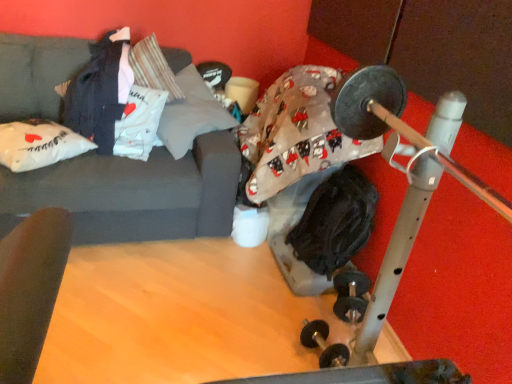
This screenshot has height=384, width=512. What do you see at coordinates (351, 295) in the screenshot?
I see `black rubber dumbbells at lower center` at bounding box center [351, 295].

Locate an element on the screen. dark gray fabric couch at upper left is located at coordinates (132, 193).

The height and width of the screenshot is (384, 512). What are the coordinates of `gray fabric pillow at upper center, the first pillow positioned from the right` in the screenshot? It's located at (191, 114).

The image size is (512, 384). I want to click on black rubber dumbbells at lower center, so (x=351, y=295).

Based on their sizes in the image, would you say dark gray fabric at upper left, the first clothing positioned from the top, is bigger or smaller than black fabric at center, which is the second clothing from left to right?

dark gray fabric at upper left, the first clothing positioned from the top, is bigger than black fabric at center, which is the second clothing from left to right.

From a real-world perspective, is dark gray fabric at upper left, the 2th clothing viewed from the right, under black fabric at center, the 2th clothing in the top-to-bottom sequence?

No, from a real-world perspective, dark gray fabric at upper left, the 2th clothing viewed from the right, is not under black fabric at center, the 2th clothing in the top-to-bottom sequence.

Does point (102, 125) come in front of point (320, 234)?

Yes, it is in front of point (320, 234).

Considering the positions of objects dark gray fabric at upper left, arranged as the 1th clothing when viewed from the left, and black fabric at center, acting as the first clothing starting from the bottom, in the image provided, who is more to the left, dark gray fabric at upper left, arranged as the 1th clothing when viewed from the left, or black fabric at center, acting as the first clothing starting from the bottom,?

Positioned to the left is dark gray fabric at upper left, arranged as the 1th clothing when viewed from the left.

Is black fabric at center, which is the second clothing from left to right, far away from dark gray fabric at upper left, which ranks as the 2th clothing in bottom-to-top order?

Yes.

Does black fabric at center, which is the second clothing from left to right, turn towards dark gray fabric at upper left, arranged as the 1th clothing when viewed from the left?

No, black fabric at center, which is the second clothing from left to right, does not turn towards dark gray fabric at upper left, arranged as the 1th clothing when viewed from the left.

You are a GUI agent. You are given a task and a screenshot of the screen. Output one action in this format:
    pyautogui.click(x=<x>, y=<y>)
    Task: Click on the clothing below the dark gray fabric at upper left, arranged as the 1th clothing when viewed from the left (from the image's perspective)
    This screenshot has width=512, height=384.
    Given the screenshot: What is the action you would take?
    pyautogui.click(x=335, y=221)

Between black fabric at center, acting as the first clothing starting from the bottom, and dark gray fabric at upper left, which ranks as the 2th clothing in bottom-to-top order, which one is positioned in front?

black fabric at center, acting as the first clothing starting from the bottom, is in front.

Based on their positions, is dark gray fabric couch at upper left located to the left or right of white fabric pillow at left, arranged as the 2th pillow when viewed from the right?

dark gray fabric couch at upper left is positioned on white fabric pillow at left, arranged as the 2th pillow when viewed from the right,'s right side.

From a real-world perspective, count 1st pillows upward from the dark gray fabric couch at upper left and point to it. Please provide its 2D coordinates.

[(39, 144)]

Which object is closer to the camera taking this photo, dark gray fabric couch at upper left or white fabric pillow at left, arranged as the 2th pillow when viewed from the right?

dark gray fabric couch at upper left is closer to the camera.

Is dark gray fabric couch at upper left spatially inside white fabric pillow at left, marked as the first pillow in a left-to-right arrangement, or outside of it?

dark gray fabric couch at upper left is outside white fabric pillow at left, marked as the first pillow in a left-to-right arrangement.

Between white fabric pillow at left, arranged as the 2th pillow when viewed from the right, and dark gray fabric couch at upper left, which one is positioned in front?

Positioned in front is dark gray fabric couch at upper left.

Is white fabric pillow at left, arranged as the 2th pillow when viewed from the right, situated inside dark gray fabric couch at upper left or outside?

white fabric pillow at left, arranged as the 2th pillow when viewed from the right, can be found inside dark gray fabric couch at upper left.

Is there a large distance between white fabric pillow at left, arranged as the 2th pillow when viewed from the right, and dark gray fabric couch at upper left?

Actually, white fabric pillow at left, arranged as the 2th pillow when viewed from the right, and dark gray fabric couch at upper left are a little close together.

Considering the sizes of objects white fabric pillow at left, arranged as the 2th pillow when viewed from the right, and dark gray fabric couch at upper left in the image provided, who is thinner, white fabric pillow at left, arranged as the 2th pillow when viewed from the right, or dark gray fabric couch at upper left?

white fabric pillow at left, arranged as the 2th pillow when viewed from the right.

Consider the image. How many degrees apart are the facing directions of white fabric pillow at left, arranged as the 2th pillow when viewed from the right, and black rubber dumbbells at lower center?

The angle between the facing direction of white fabric pillow at left, arranged as the 2th pillow when viewed from the right, and the facing direction of black rubber dumbbells at lower center is 159 degrees.

Is point (29, 149) positioned behind point (351, 274)?

No, (29, 149) is closer to viewer.

Is white fabric pillow at left, marked as the first pillow in a left-to-right arrangement, taller or shorter than black rubber dumbbells at lower center?

white fabric pillow at left, marked as the first pillow in a left-to-right arrangement, is shorter than black rubber dumbbells at lower center.

Does white fabric pillow at left, arranged as the 2th pillow when viewed from the right, turn towards black rubber dumbbells at lower center?

No, white fabric pillow at left, arranged as the 2th pillow when viewed from the right, does not turn towards black rubber dumbbells at lower center.

Locate an element on the screen. studio couch that is in front of the gray fabric pillow at upper center, positioned as the second pillow in left-to-right order is located at coordinates (132, 193).

Is the surface of dark gray fabric couch at upper left in direct contact with gray fabric pillow at upper center, the first pillow positioned from the right?

dark gray fabric couch at upper left is not next to gray fabric pillow at upper center, the first pillow positioned from the right, and they're not touching.

Who is shorter, dark gray fabric couch at upper left or gray fabric pillow at upper center, positioned as the second pillow in left-to-right order?

Standing shorter between the two is gray fabric pillow at upper center, positioned as the second pillow in left-to-right order.

Considering the points (159, 184) and (180, 88), which point is behind, point (159, 184) or point (180, 88)?

The point (180, 88) is farther from the camera.

From a real-world perspective, which pillow is the 1st one above the black fabric at center, the 2th clothing in the top-to-bottom sequence? Please provide its 2D coordinates.

[(39, 144)]

From the image's perspective, is black fabric at center, which is the second clothing from left to right, above or below white fabric pillow at left, marked as the first pillow in a left-to-right arrangement?

Answer: Based on their image positions, black fabric at center, which is the second clothing from left to right, is located beneath white fabric pillow at left, marked as the first pillow in a left-to-right arrangement.

Considering the positions of objects black fabric at center, the 2th clothing in the top-to-bottom sequence, and white fabric pillow at left, arranged as the 2th pillow when viewed from the right, in the image provided, who is more to the right, black fabric at center, the 2th clothing in the top-to-bottom sequence, or white fabric pillow at left, arranged as the 2th pillow when viewed from the right,?

black fabric at center, the 2th clothing in the top-to-bottom sequence.

Would you say black fabric at center, which is the second clothing from left to right, is inside or outside white fabric pillow at left, arranged as the 2th pillow when viewed from the right?

black fabric at center, which is the second clothing from left to right, is not enclosed by white fabric pillow at left, arranged as the 2th pillow when viewed from the right.

This screenshot has height=384, width=512. What are the coordinates of `clothing on the right side of dark gray fabric at upper left, arranged as the 1th clothing when viewed from the left` in the screenshot? It's located at (335, 221).

Locate an element on the screen. This screenshot has height=384, width=512. clothing above the black fabric at center, acting as the first clothing starting from the bottom (from the image's perspective) is located at coordinates (100, 90).

Which object lies nearer to the anchor point dark gray fabric at upper left, the 2th clothing viewed from the right, gray fabric pillow at upper center, the first pillow positioned from the right, or white fabric pillow at left, marked as the first pillow in a left-to-right arrangement?

white fabric pillow at left, marked as the first pillow in a left-to-right arrangement.

When comparing their distances from black rubber dumbbells at lower center, does black fabric at center, which is the second clothing from left to right, or white fabric pillow at left, arranged as the 2th pillow when viewed from the right, seem closer?

Based on the image, black fabric at center, which is the second clothing from left to right, appears to be nearer to black rubber dumbbells at lower center.

When comparing their distances from white fabric pillow at left, arranged as the 2th pillow when viewed from the right, does gray fabric pillow at upper center, positioned as the second pillow in left-to-right order, or black rubber dumbbells at lower center seem closer?

Among the two, gray fabric pillow at upper center, positioned as the second pillow in left-to-right order, is located nearer to white fabric pillow at left, arranged as the 2th pillow when viewed from the right.

From the picture: Based on their spatial positions, is white fabric pillow at left, marked as the first pillow in a left-to-right arrangement, or dark gray fabric at upper left, which ranks as the 2th clothing in bottom-to-top order, closer to black rubber dumbbells at lower center?

dark gray fabric at upper left, which ranks as the 2th clothing in bottom-to-top order, is positioned closer to the anchor black rubber dumbbells at lower center.

Looking at the image, which one is located closer to gray fabric pillow at upper center, positioned as the second pillow in left-to-right order, dark gray fabric at upper left, which ranks as the 2th clothing in bottom-to-top order, or black fabric at center, which is the second clothing from left to right?

Based on the image, dark gray fabric at upper left, which ranks as the 2th clothing in bottom-to-top order, appears to be nearer to gray fabric pillow at upper center, positioned as the second pillow in left-to-right order.

Based on their spatial positions, is dark gray fabric couch at upper left or white fabric pillow at left, arranged as the 2th pillow when viewed from the right, closer to black fabric at center, which is counted as the first clothing, starting from the right?

dark gray fabric couch at upper left is closer to black fabric at center, which is counted as the first clothing, starting from the right.

Which object lies further to the anchor point dark gray fabric at upper left, the 2th clothing viewed from the right, black fabric at center, which is the second clothing from left to right, or white fabric pillow at left, marked as the first pillow in a left-to-right arrangement?

black fabric at center, which is the second clothing from left to right, is further to dark gray fabric at upper left, the 2th clothing viewed from the right.

Estimate the real-world distances between objects in this image. Which object is closer to gray fabric pillow at upper center, the first pillow positioned from the right, dark gray fabric at upper left, the 2th clothing viewed from the right, or dark gray fabric couch at upper left?

dark gray fabric couch at upper left.

This screenshot has width=512, height=384. What are the coordinates of `clothing between gray fabric pillow at upper center, the first pillow positioned from the right, and black rubber dumbbells at lower center in the up-down direction` in the screenshot? It's located at (335, 221).

This screenshot has height=384, width=512. In order to click on pillow located between white fabric pillow at left, arranged as the 2th pillow when viewed from the right, and black fabric at center, acting as the first clothing starting from the bottom, in the left-right direction in this screenshot , I will do `click(191, 114)`.

Where is `clothing between dark gray fabric at upper left, the 2th clothing viewed from the right, and black rubber dumbbells at lower center from left to right`? Image resolution: width=512 pixels, height=384 pixels. clothing between dark gray fabric at upper left, the 2th clothing viewed from the right, and black rubber dumbbells at lower center from left to right is located at coordinates (335, 221).

Where is `studio couch between white fabric pillow at left, marked as the first pillow in a left-to-right arrangement, and black fabric at center, the 2th clothing in the top-to-bottom sequence, in the horizontal direction`? studio couch between white fabric pillow at left, marked as the first pillow in a left-to-right arrangement, and black fabric at center, the 2th clothing in the top-to-bottom sequence, in the horizontal direction is located at coordinates (132, 193).